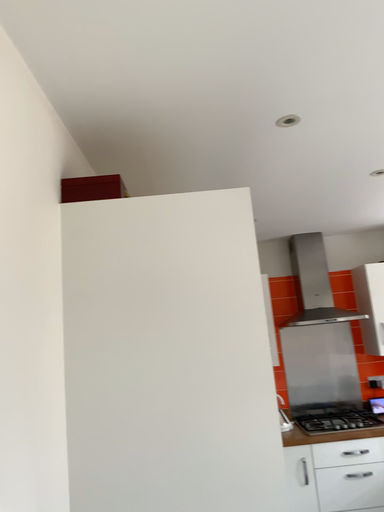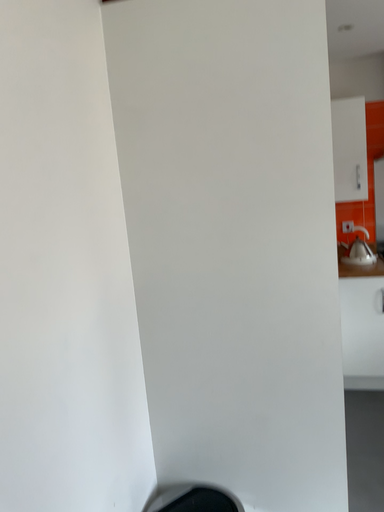
Question: Which way did the camera rotate in the video?

Choices:
 (A) rotated downward
 (B) rotated upward

Answer: (A)